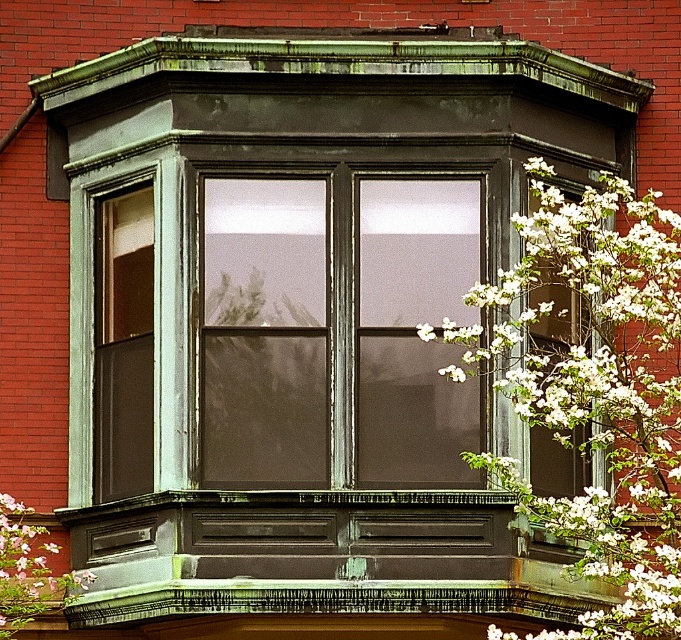
You are standing in a garden 200 feet away from a house with a bay window. You see the matte glass window at center. Can you reach it by walking straight ahead?

The matte glass window at center is 236.03 feet away from viewer, so walking straight ahead from 200 feet would not reach it since it is further away.

You are an interior designer assessing the bay window area. You notice the matte glass window at center and the white blossoms at right. Which object takes up more visual space in the scene?

The white blossoms at right occupy more visual space than the matte glass window at center according to the description.